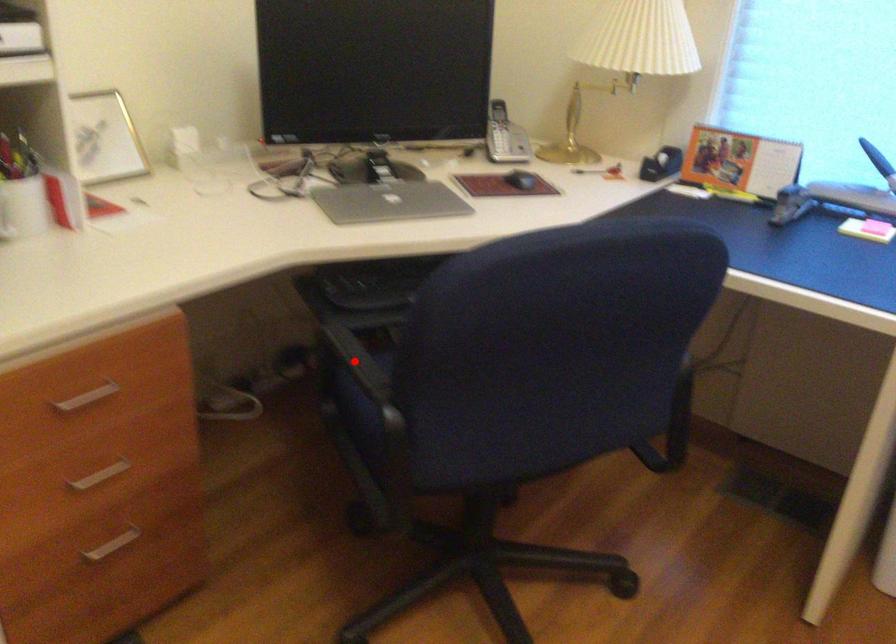
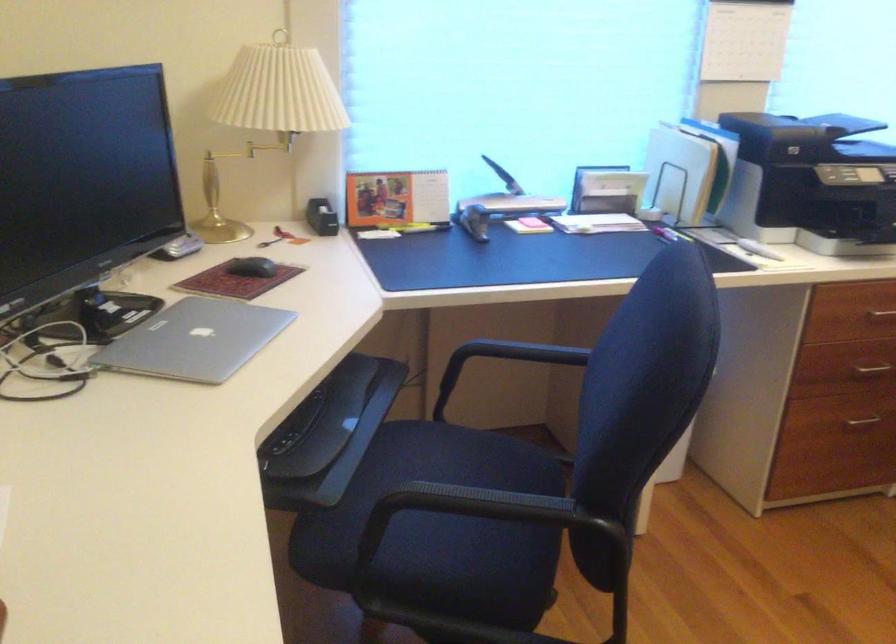
Where in the second image is the point corresponding to the highlighted location from the first image?

(458, 511)